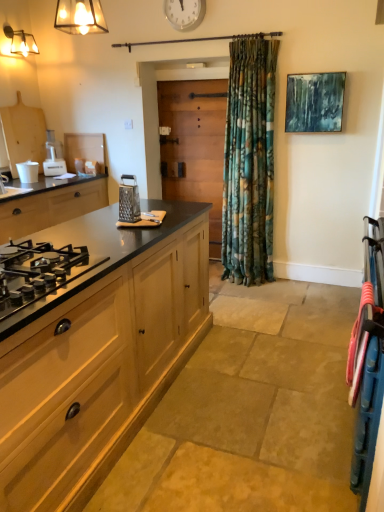
Question: Could wooden at center be considered to be inside metallic glass light fixture at upper left?

Choices:
 (A) no
 (B) yes

Answer: (A)

Question: Can you confirm if metallic glass light fixture at upper left is wider than wooden at center?

Choices:
 (A) no
 (B) yes

Answer: (B)

Question: Is metallic glass light fixture at upper left closer to camera compared to wooden at center?

Choices:
 (A) no
 (B) yes

Answer: (B)

Question: Considering the relative positions of metallic glass light fixture at upper left and wooden at center in the image provided, is metallic glass light fixture at upper left behind wooden at center?

Choices:
 (A) no
 (B) yes

Answer: (A)

Question: From the image's perspective, is metallic glass light fixture at upper left on wooden at center?

Choices:
 (A) no
 (B) yes

Answer: (B)

Question: Would you say white plastic food processor at left, the 1th appliance positioned from the top, is to the left or to the right of wooden cabinet at left, placed as the 2th cabinetry when sorted from left to right, in the picture?

Choices:
 (A) left
 (B) right

Answer: (A)

Question: From their relative heights in the image, would you say white plastic food processor at left, the 1th appliance positioned from the top, is taller or shorter than wooden cabinet at left, placed as the 2th cabinetry when sorted from left to right?

Choices:
 (A) short
 (B) tall

Answer: (B)

Question: From a real-world perspective, is white plastic food processor at left, which is counted as the second appliance, starting from the front, positioned above or below wooden cabinet at left, the second cabinetry positioned from the top?

Choices:
 (A) above
 (B) below

Answer: (A)

Question: Based on their sizes in the image, would you say white plastic food processor at left, which appears as the 1th appliance when viewed from the back, is bigger or smaller than wooden cabinet at left, placed as the 2th cabinetry when sorted from left to right?

Choices:
 (A) big
 (B) small

Answer: (B)

Question: Considering the positions of white plastic clock at upper center and white plastic food processor at left, which is counted as the second appliance, starting from the front, in the image, is white plastic clock at upper center taller or shorter than white plastic food processor at left, which is counted as the second appliance, starting from the front,?

Choices:
 (A) tall
 (B) short

Answer: (B)

Question: Considering the positions of white plastic clock at upper center and white plastic food processor at left, which is counted as the second appliance, starting from the front, in the image, is white plastic clock at upper center bigger or smaller than white plastic food processor at left, which is counted as the second appliance, starting from the front,?

Choices:
 (A) big
 (B) small

Answer: (B)

Question: Considering the relative positions of white plastic clock at upper center and white plastic food processor at left, the 1th appliance positioned from the top, in the image provided, is white plastic clock at upper center to the left or to the right of white plastic food processor at left, the 1th appliance positioned from the top,?

Choices:
 (A) left
 (B) right

Answer: (B)

Question: Relative to white plastic food processor at left, which appears as the 1th appliance when viewed from the back, is white plastic clock at upper center in front or behind?

Choices:
 (A) behind
 (B) front

Answer: (B)

Question: Relative to black matte gas stove at left, the 1th cabinetry in the top-to-bottom sequence, is white plastic clock at upper center in front or behind?

Choices:
 (A) behind
 (B) front

Answer: (A)

Question: Is point (188, 26) closer or farther from the camera than point (21, 214)?

Choices:
 (A) closer
 (B) farther

Answer: (B)